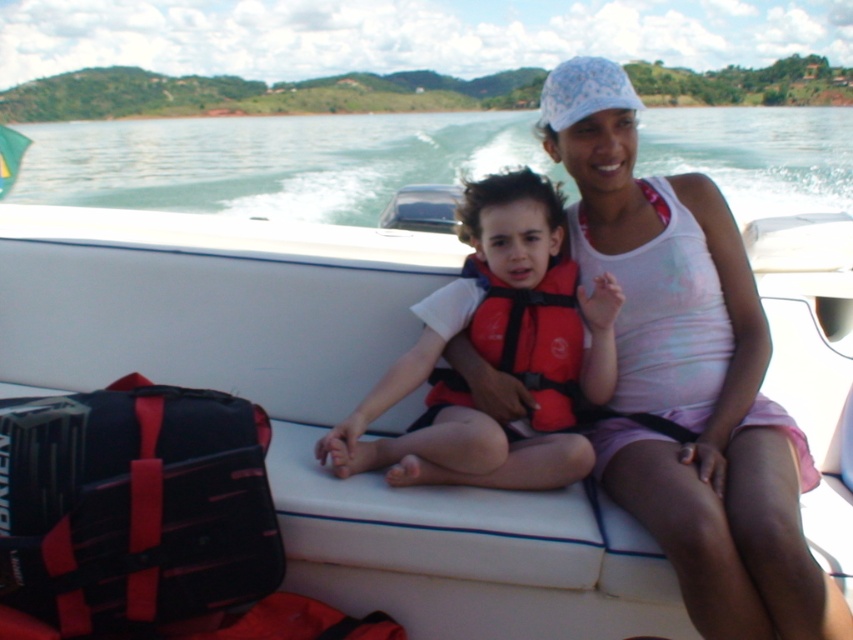
Who is more distant from viewer, [184,164] or [403,387]?

Positioned behind is point [184,164].

Is point (18, 125) closer to viewer compared to point (537, 353)?

No.

What do you see at coordinates (270, 161) in the screenshot? This screenshot has height=640, width=853. I see `green water at upper center` at bounding box center [270, 161].

Image resolution: width=853 pixels, height=640 pixels. Find the location of `green water at upper center`. green water at upper center is located at coordinates (270, 161).

Which is behind, point (450, 476) or point (579, 314)?

Positioned behind is point (579, 314).

Does matte orange life vest at center come in front of red fabric life jacket at center?

That is True.

This screenshot has width=853, height=640. Identify the location of matte orange life vest at center. (495, 355).

Is white tank top at center wider than red fabric life jacket at center?

Yes.

This screenshot has width=853, height=640. Describe the element at coordinates (689, 376) in the screenshot. I see `white tank top at center` at that location.

Is point (764, 532) in front of point (486, 275)?

Yes.

Where is `white tank top at center`? white tank top at center is located at coordinates (689, 376).